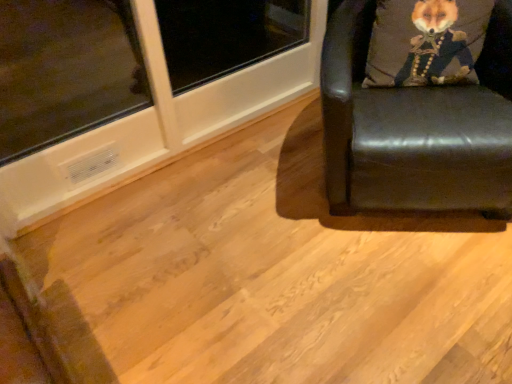
Question: Relative to velvet fox head at upper right, is black leather chair at right in front or behind?

Choices:
 (A) front
 (B) behind

Answer: (A)

Question: From their relative heights in the image, would you say black leather chair at right is taller or shorter than velvet fox head at upper right?

Choices:
 (A) short
 (B) tall

Answer: (B)

Question: From a real-world perspective, is black leather chair at right above or below velvet fox head at upper right?

Choices:
 (A) below
 (B) above

Answer: (A)

Question: From a real-world perspective, is velvet fox head at upper right above or below black leather chair at right?

Choices:
 (A) above
 (B) below

Answer: (A)

Question: Is velvet fox head at upper right taller or shorter than black leather chair at right?

Choices:
 (A) short
 (B) tall

Answer: (A)

Question: From the image's perspective, relative to black leather chair at right, is velvet fox head at upper right above or below?

Choices:
 (A) below
 (B) above

Answer: (B)

Question: Relative to black leather chair at right, is velvet fox head at upper right in front or behind?

Choices:
 (A) front
 (B) behind

Answer: (B)